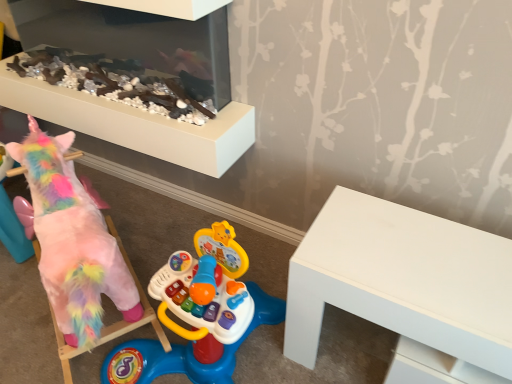
Question: From a real-world perspective, is white matte table at right above or below smooth white fireplace at upper center?

Choices:
 (A) above
 (B) below

Answer: (B)

Question: Considering the positions of white matte table at right and smooth white fireplace at upper center in the image, is white matte table at right taller or shorter than smooth white fireplace at upper center?

Choices:
 (A) short
 (B) tall

Answer: (B)

Question: Considering the real-world distances, which object is closest to the white matte table at right?

Choices:
 (A) fluffy pink unicorn at left
 (B) smooth white fireplace at upper center

Answer: (A)

Question: Which of these objects is positioned closest to the smooth white fireplace at upper center?

Choices:
 (A) white matte table at right
 (B) fluffy pink unicorn at left

Answer: (B)